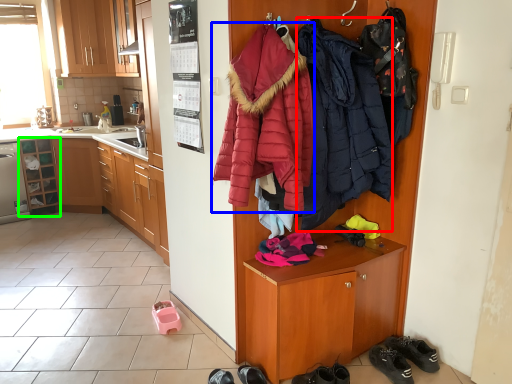
Question: Based on their relative distances, which object is farther from jacket (highlighted by a red box)? Choose from jacket (highlighted by a blue box) and cabinetry (highlighted by a green box).

Choices:
 (A) jacket
 (B) cabinetry

Answer: (B)